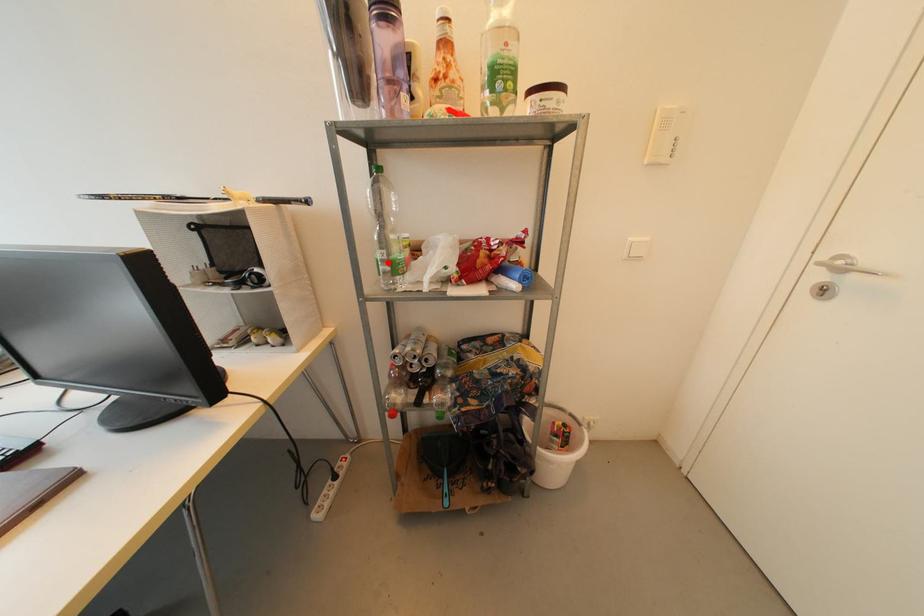
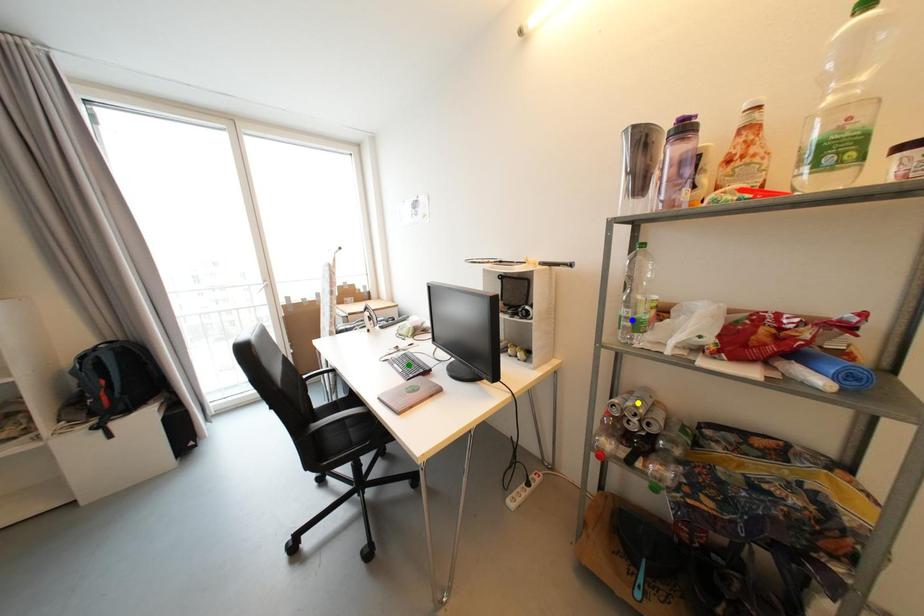
Question: I am providing you with two images of the same scene from different viewpoints. A red point is marked on the first image. You are given multiple points on the second image. Which point in image 2 is actually the same real-world point as the red point in image 1?

Choices:
 (A) blue point
 (B) green point
 (C) yellow point

Answer: (A)